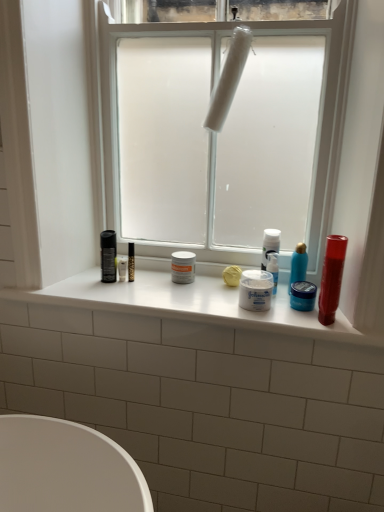
This screenshot has width=384, height=512. I want to click on free space to the left of white matte jar at center, the third toiletry positioned from the right, so click(x=207, y=298).